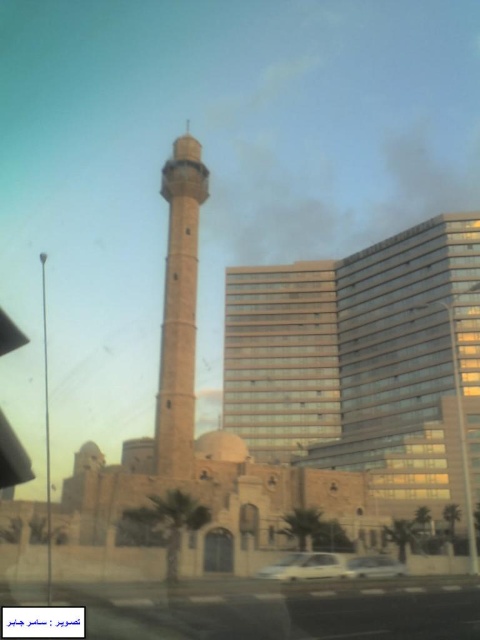
Is beige stone minaret at center positioned in front of transparent plastic car window at center?

No.

You are a GUI agent. You are given a task and a screenshot of the screen. Output one action in this format:
    pyautogui.click(x=<x>, y=<y>)
    Task: Click on the beige stone minaret at center
    The width and height of the screenshot is (480, 640).
    Given the screenshot: What is the action you would take?
    pyautogui.click(x=179, y=308)

Describe the element at coordinates (179, 308) in the screenshot. I see `beige stone minaret at center` at that location.

Who is taller, beige stone minaret at center or metallic silver car at center?

beige stone minaret at center is taller.

Who is more forward, (x=176, y=340) or (x=356, y=556)?

Point (x=356, y=556) is more forward.

At what (x,y) coordinates should I click in order to perform the action: click on beige stone minaret at center. Please return your answer as a coordinate pair (x, y). Image resolution: width=480 pixels, height=640 pixels. Looking at the image, I should click on (179, 308).

Does beige stone tower at center have a lesser height compared to metallic silver car at center?

In fact, beige stone tower at center may be taller than metallic silver car at center.

From the picture: Is beige stone tower at center further to camera compared to metallic silver car at center?

Yes, it is behind metallic silver car at center.

This screenshot has width=480, height=640. I want to click on beige stone tower at center, so click(x=280, y=356).